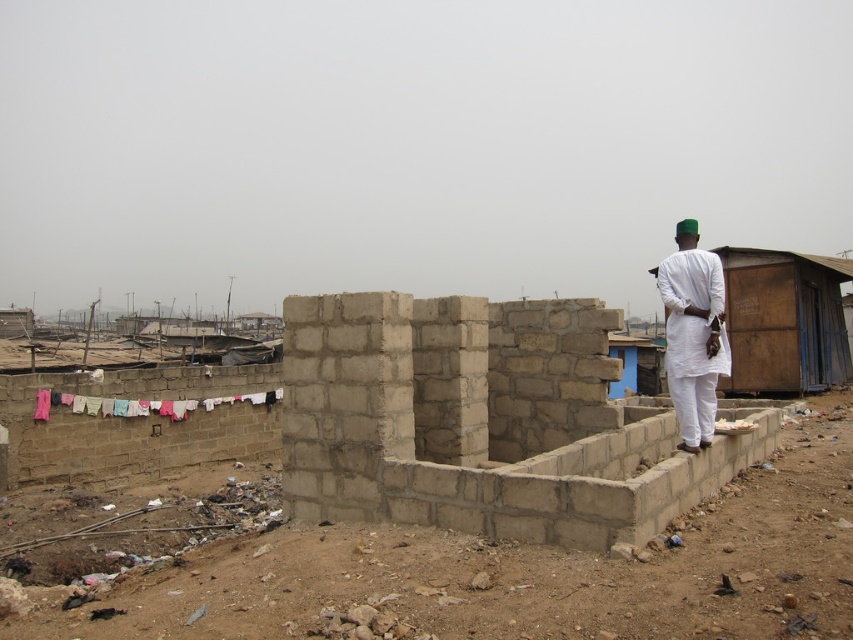
Question: Does white cotton shirt at right have a greater width compared to multicolored fabric at left?

Choices:
 (A) yes
 (B) no

Answer: (B)

Question: Estimate the real-world distances between objects in this image. Which object is farther from the white cotton shirt at right?

Choices:
 (A) multicolored fabric at left
 (B) wooden hut at right

Answer: (A)

Question: Which point is closer to the camera?

Choices:
 (A) multicolored fabric at left
 (B) wooden hut at right

Answer: (B)

Question: Can you confirm if white cotton shirt at right is positioned to the right of multicolored fabric at left?

Choices:
 (A) no
 (B) yes

Answer: (B)

Question: Which point is farther from the camera taking this photo?

Choices:
 (A) (96, 401)
 (B) (802, 288)
 (C) (689, 230)

Answer: (B)

Question: Does wooden hut at right come in front of multicolored fabric at left?

Choices:
 (A) no
 (B) yes

Answer: (B)